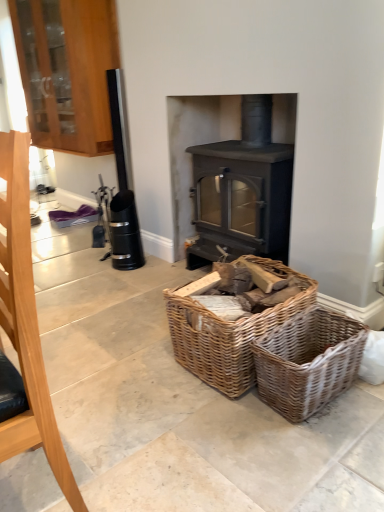
Where is `vacant space that is to the left of woven wood basket at center`? vacant space that is to the left of woven wood basket at center is located at coordinates (134, 364).